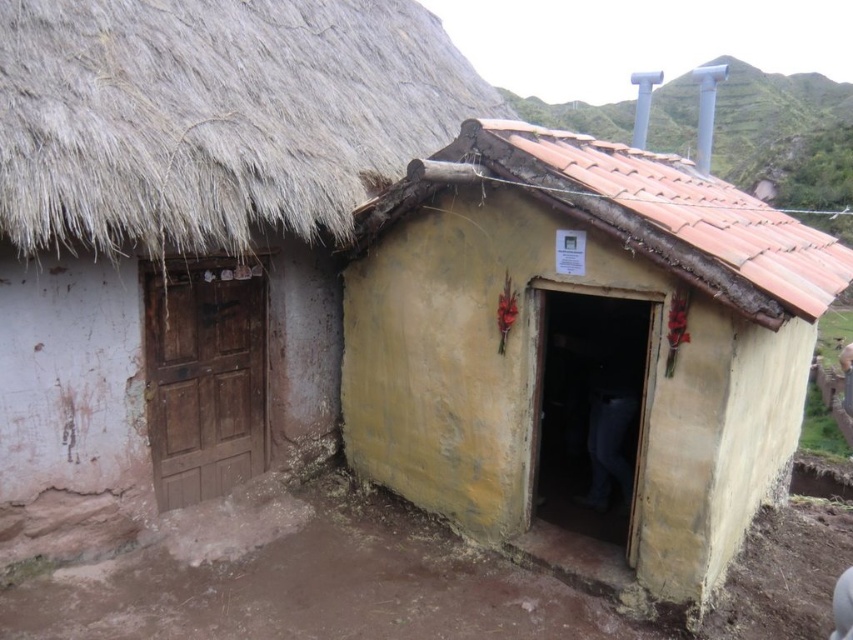
Which is more to the left, yellow mud hut at center or thatched straw roof at upper left?

Positioned to the left is thatched straw roof at upper left.

Looking at this image, is yellow mud hut at center below thatched straw roof at upper left?

Indeed, yellow mud hut at center is positioned under thatched straw roof at upper left.

Where is `yellow mud hut at center`? yellow mud hut at center is located at coordinates (579, 342).

In the scene shown: Does yellow mud hut at center appear on the right side of brown clay mud at lower center?

Indeed, yellow mud hut at center is positioned on the right side of brown clay mud at lower center.

Which is in front, point (616, 285) or point (802, 625)?

Positioned in front is point (616, 285).

Where is `yellow mud hut at center`? The image size is (853, 640). yellow mud hut at center is located at coordinates (579, 342).

Locate an element on the screen. This screenshot has width=853, height=640. yellow mud hut at center is located at coordinates (579, 342).

Can you confirm if thatched straw roof at upper left is positioned below terracotta tiled roof at center?

Actually, thatched straw roof at upper left is above terracotta tiled roof at center.

Which is below, thatched straw roof at upper left or terracotta tiled roof at center?

terracotta tiled roof at center is lower down.

The image size is (853, 640). I want to click on thatched straw roof at upper left, so click(215, 116).